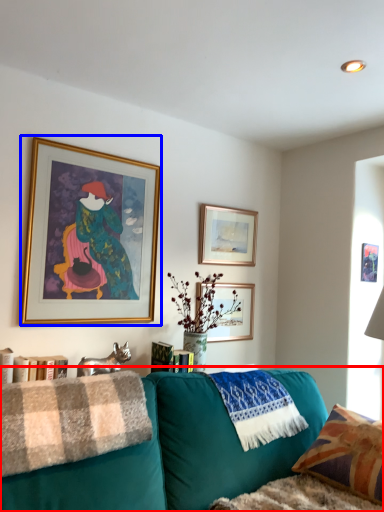
Question: Which object is further to the camera taking this photo, studio couch (highlighted by a red box) or picture frame (highlighted by a blue box)?

Choices:
 (A) studio couch
 (B) picture frame

Answer: (B)